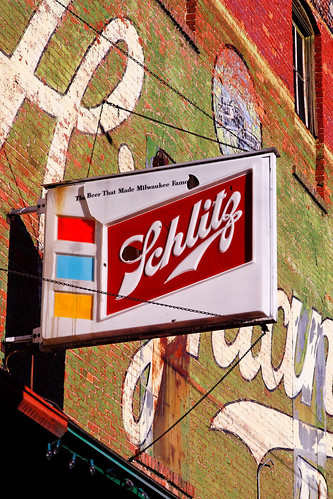
The height and width of the screenshot is (499, 333). Identify the location of bulbs in stringlights. (49, 457), (55, 450), (71, 463), (92, 470), (129, 484), (144, 493).